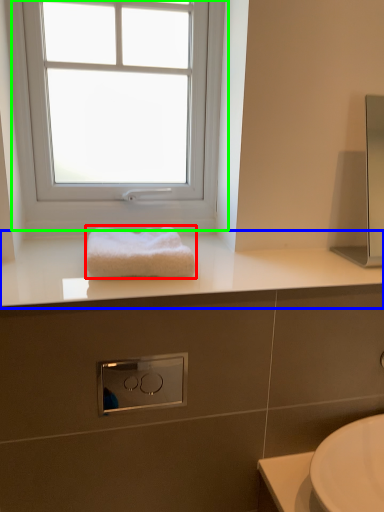
Question: Considering the real-world distances, which object is farthest from towel (highlighted by a red box)? countertop (highlighted by a blue box) or window (highlighted by a green box)?

Choices:
 (A) countertop
 (B) window

Answer: (B)